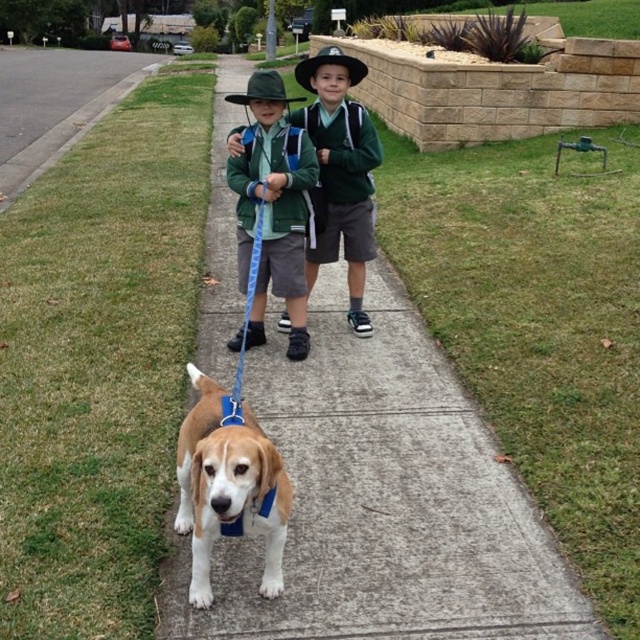
Question: Which point is closer to the camera?

Choices:
 (A) (410, 433)
 (B) (337, 173)

Answer: (A)

Question: Which of these objects is positioned closest to the green matte uniform at center?

Choices:
 (A) concrete at center
 (B) green grass at lower left

Answer: (A)

Question: Which point is farther to the camera?

Choices:
 (A) (145, 65)
 (B) (365, 436)

Answer: (A)

Question: Does green matte uniform at center appear on the left side of green grass at lower left?

Choices:
 (A) no
 (B) yes

Answer: (A)

Question: Can you confirm if concrete at center is positioned to the right of green matte uniform at center?

Choices:
 (A) no
 (B) yes

Answer: (A)

Question: Is brown matte dog at center below green grass at lower left?

Choices:
 (A) no
 (B) yes

Answer: (B)